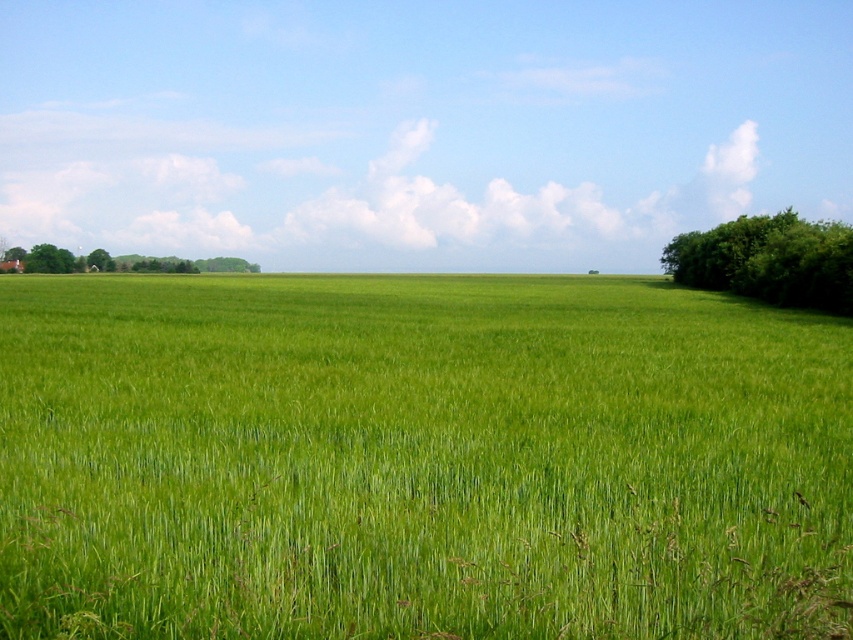
Does green grass at center appear on the left side of green leafy tree at right?

Yes, green grass at center is to the left of green leafy tree at right.

Is green grass at center bigger than green leafy tree at right?

Yes.

Is point (413, 616) farther from viewer compared to point (703, 284)?

No.

This screenshot has width=853, height=640. What are the coordinates of `green grass at center` in the screenshot? It's located at (419, 460).

How distant is green leafy trees at left from green leafy tree at left?

They are 8.66 meters apart.

Is green leafy trees at left further to the viewer compared to green leafy tree at left?

Yes, green leafy trees at left is behind green leafy tree at left.

Locate an element on the screen. The width and height of the screenshot is (853, 640). green leafy trees at left is located at coordinates (167, 262).

Does green leafy trees at left have a greater height compared to green grassy field at center?

Indeed, green leafy trees at left has a greater height compared to green grassy field at center.

Can you confirm if green leafy trees at left is smaller than green grassy field at center?

Incorrect, green leafy trees at left is not smaller in size than green grassy field at center.

Which is in front, point (59, 266) or point (90, 260)?

Positioned in front is point (59, 266).

Image resolution: width=853 pixels, height=640 pixels. I want to click on green leafy trees at left, so click(167, 262).